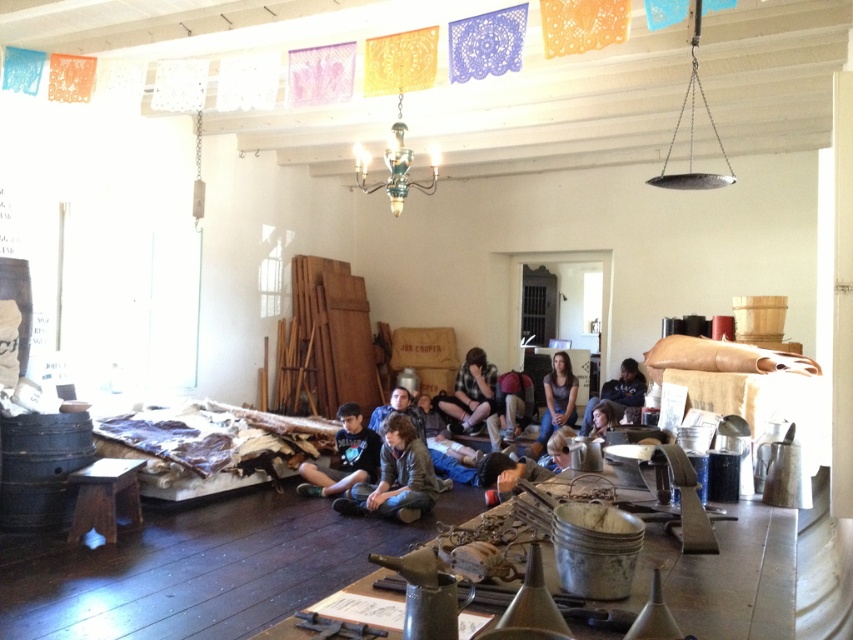
Question: Which of the following is the farthest from the observer?

Choices:
 (A) (410, 496)
 (B) (514, 465)
 (C) (500, 387)

Answer: (C)

Question: Which object appears closest to the camera in this image?

Choices:
 (A) dark brown leather jacket at center
 (B) brown leather jacket at lower center

Answer: (B)

Question: Can you confirm if leather jacket at center is positioned to the right of dark blue jeans at center?

Choices:
 (A) yes
 (B) no

Answer: (B)

Question: Which object is positioned farthest from the dark brown leather jacket at center?

Choices:
 (A) metallic chandelier at upper center
 (B) checkered fabric shirt at center
 (C) brown leather jacket at lower center

Answer: (A)

Question: Is leather jacket at center above brown leather jacket at lower center?

Choices:
 (A) yes
 (B) no

Answer: (B)

Question: Does metallic chandelier at upper center come behind matte brown backpack at center?

Choices:
 (A) no
 (B) yes

Answer: (A)